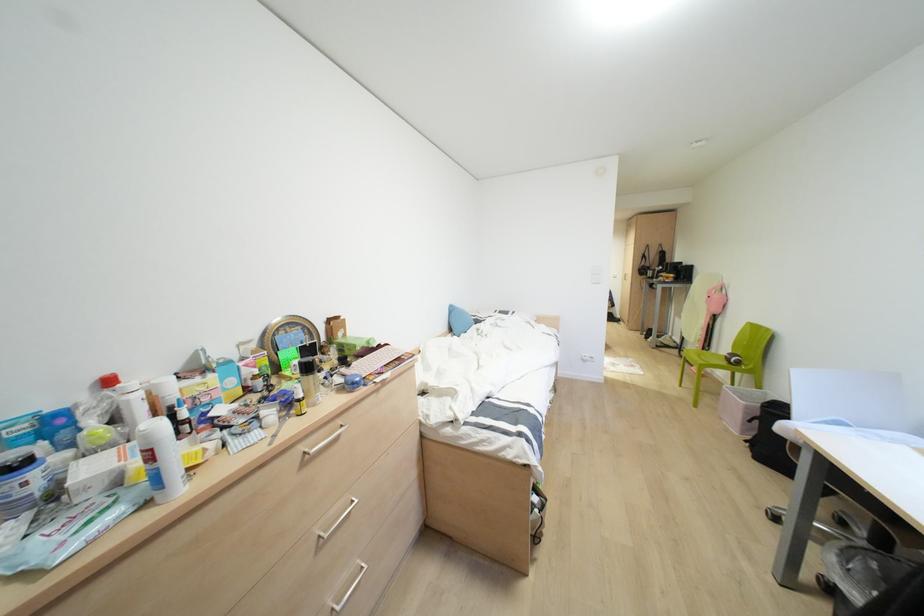
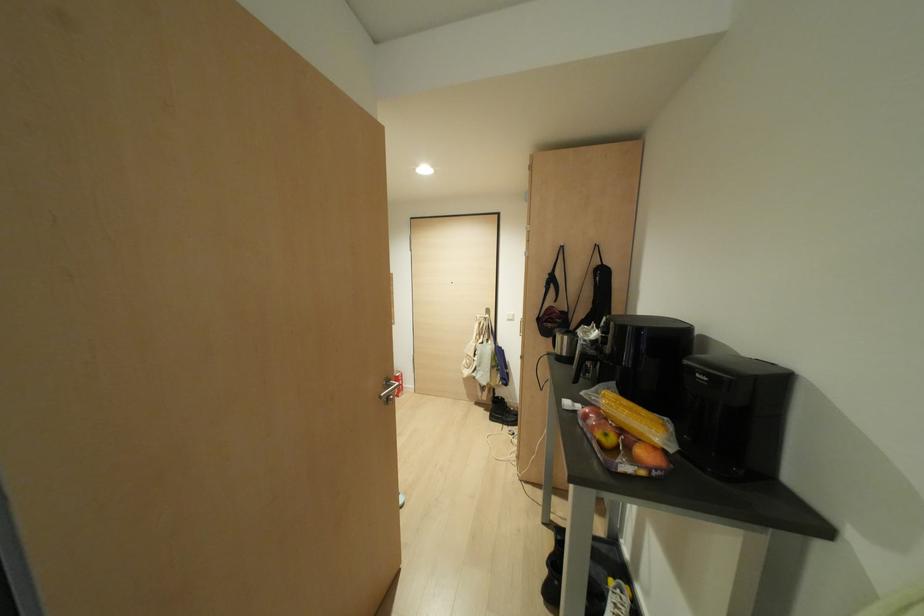
The point at (642, 256) is marked in the first image. Where is the corresponding point in the second image?

(551, 280)